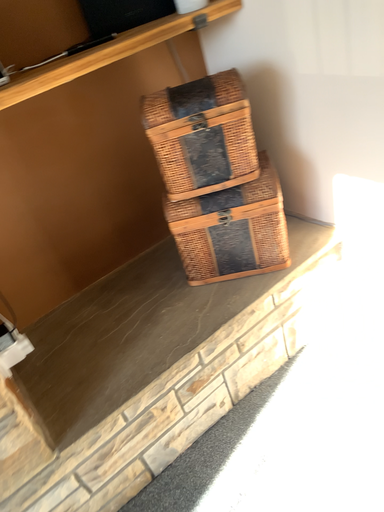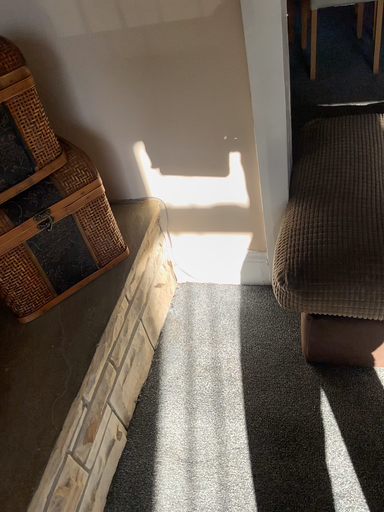
Question: Which way did the camera rotate in the video?

Choices:
 (A) rotated upward
 (B) rotated downward

Answer: (A)